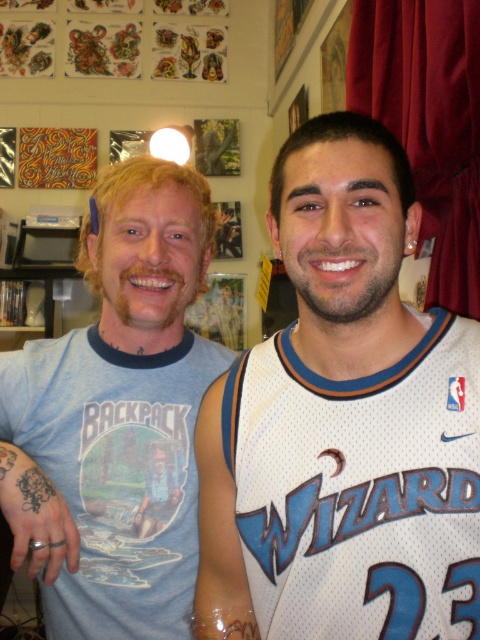
You are a photographer standing in a room and want to capture a closeup of the clear plastic bandage at upper right without including the white jersey at center in the frame. Given that your camera has a focal length of 50mm and a sensor size of 24mm x 36mm, what is the minimum distance you need to stand from the clear plastic bandage to achieve this?

The minimum distance required is approximately 4.12 inches divided by the crop factor of 1.5, resulting in about 2.75 inches. However, practically, you would need to ensure the camera is positioned so the white jersey at center is outside the frame, which would require moving closer than 4.12 inches. But since the objects are 4.12 inches apart, moving closer than that distance might still include the jersey depending on lens angle. A more precise calculation using sensor dimensions and focal length shows a